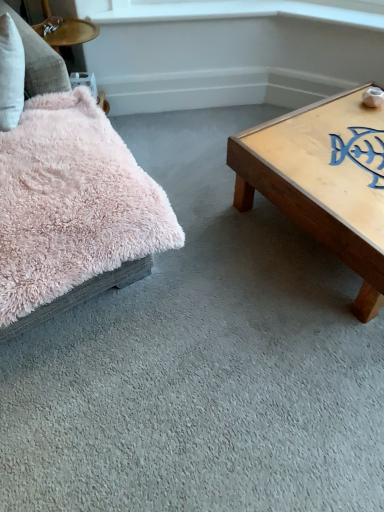
Question: From the image's perspective, is fluffy pink pillow at left below fuzzy pink pillow at upper left?

Choices:
 (A) no
 (B) yes

Answer: (B)

Question: Does fluffy pink pillow at left touch fuzzy pink pillow at upper left?

Choices:
 (A) no
 (B) yes

Answer: (A)

Question: Considering the relative sizes of fluffy pink pillow at left and fuzzy pink pillow at upper left in the image provided, is fluffy pink pillow at left wider than fuzzy pink pillow at upper left?

Choices:
 (A) no
 (B) yes

Answer: (B)

Question: Is fluffy pink pillow at left closer to the viewer compared to fuzzy pink pillow at upper left?

Choices:
 (A) yes
 (B) no

Answer: (A)

Question: From a real-world perspective, is fluffy pink pillow at left physically above fuzzy pink pillow at upper left?

Choices:
 (A) no
 (B) yes

Answer: (A)

Question: Is fluffy pink pillow at left to the right of fuzzy pink pillow at upper left from the viewer's perspective?

Choices:
 (A) yes
 (B) no

Answer: (A)

Question: From a real-world perspective, is white glossy window sill at upper center physically below fluffy pink pillow at left?

Choices:
 (A) no
 (B) yes

Answer: (A)

Question: Is the position of white glossy window sill at upper center more distant than that of fluffy pink pillow at left?

Choices:
 (A) yes
 (B) no

Answer: (A)

Question: Considering the relative positions of white glossy window sill at upper center and fluffy pink pillow at left in the image provided, is white glossy window sill at upper center to the right of fluffy pink pillow at left from the viewer's perspective?

Choices:
 (A) yes
 (B) no

Answer: (A)

Question: Can you confirm if white glossy window sill at upper center is bigger than fluffy pink pillow at left?

Choices:
 (A) no
 (B) yes

Answer: (A)

Question: From the image's perspective, is white glossy window sill at upper center beneath fluffy pink pillow at left?

Choices:
 (A) no
 (B) yes

Answer: (A)

Question: Is white glossy window sill at upper center closer to the viewer compared to fluffy pink pillow at left?

Choices:
 (A) yes
 (B) no

Answer: (B)

Question: Is fuzzy pink pillow at upper left smaller than fluffy pink pillow at left?

Choices:
 (A) yes
 (B) no

Answer: (A)